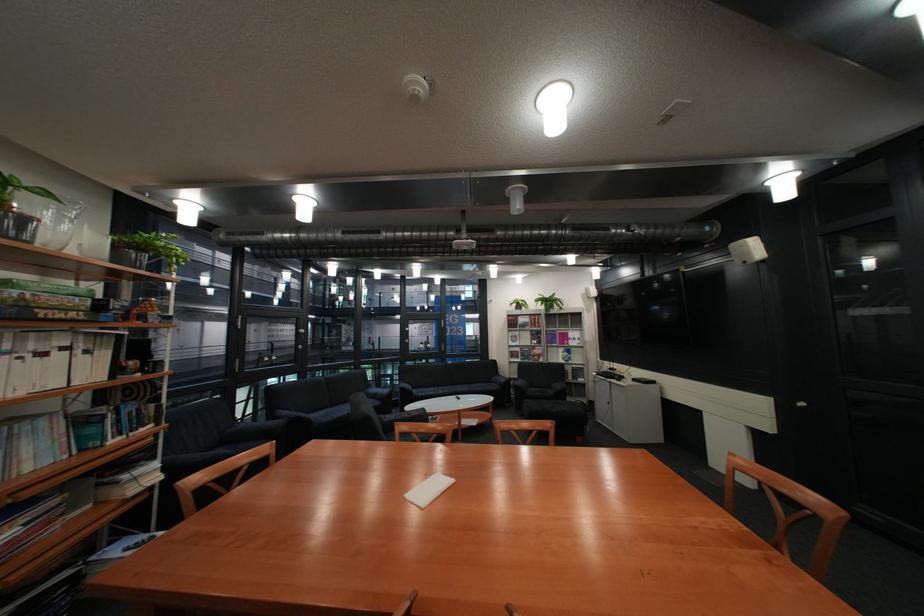
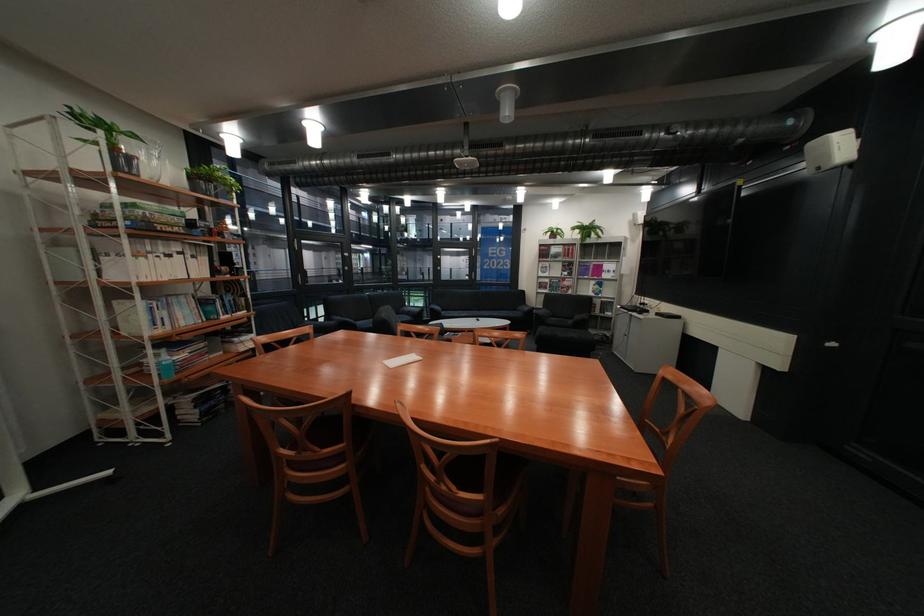
In the second image, find the point that corresponds to (505,382) in the first image.

(531, 310)